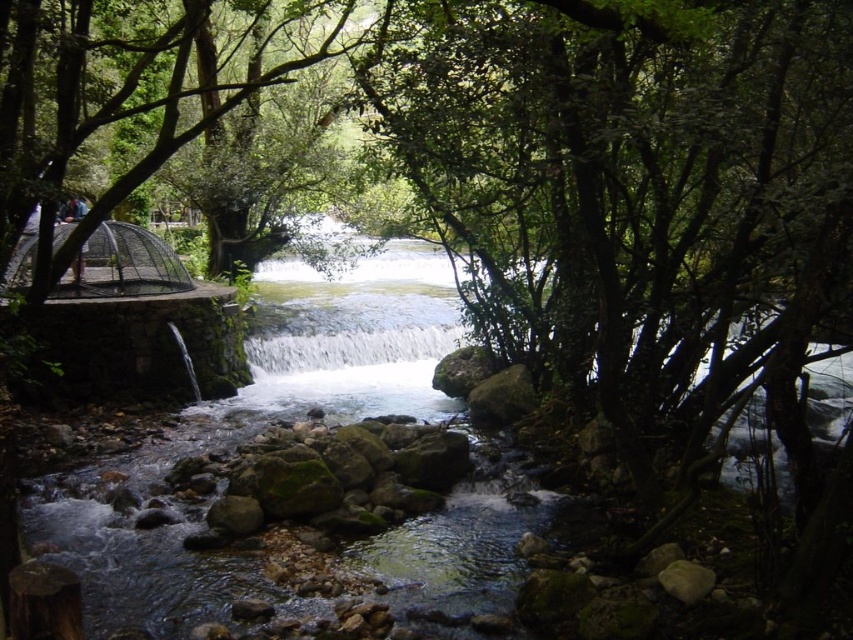
Is point (746, 243) less distant than point (370, 355)?

Yes, point (746, 243) is closer to viewer.

Which is more to the left, green leafy tree at center or white smooth waterfall at center?

white smooth waterfall at center

Between point (651, 380) and point (427, 344), which one is positioned behind?

Point (427, 344)

Find the location of a particular element. green leafy tree at center is located at coordinates (634, 195).